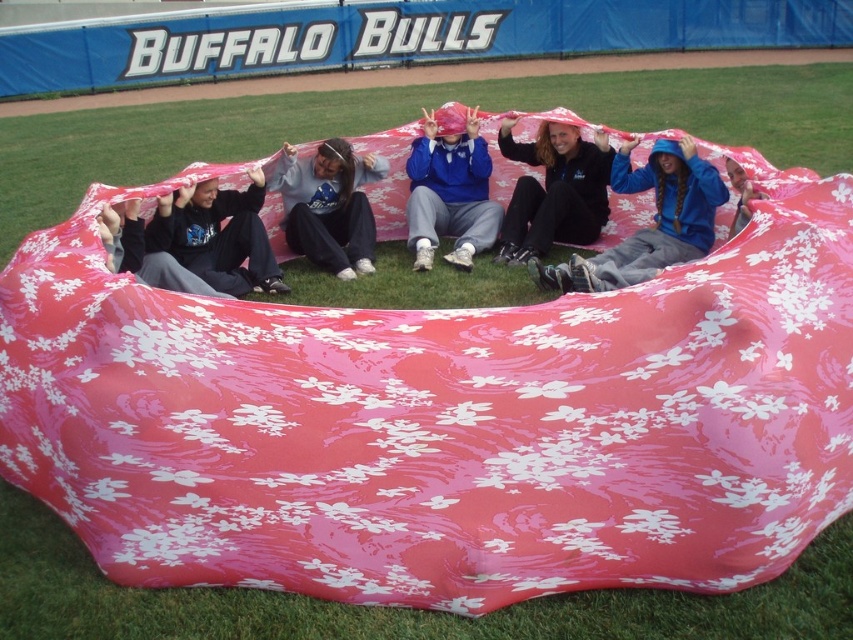
Is matte blue jacket at center thinner than matte black hoodie at left?

Yes.

Identify the location of matte blue jacket at center. This screenshot has height=640, width=853. (450, 193).

Between point (477, 204) and point (352, 193), which one is positioned in front?

Point (352, 193) is in front.

Does point (456, 189) come closer to viewer compared to point (367, 243)?

No.

The image size is (853, 640). In order to click on matte blue jacket at center in this screenshot , I will do `click(450, 193)`.

Between matte gray sweatshirt at center and matte black hoodie at left, which one appears on the right side from the viewer's perspective?

matte gray sweatshirt at center is more to the right.

Is point (340, 163) positioned before point (260, 284)?

No, (340, 163) is further to viewer.

Locate an element on the screen. The width and height of the screenshot is (853, 640). matte gray sweatshirt at center is located at coordinates (328, 205).